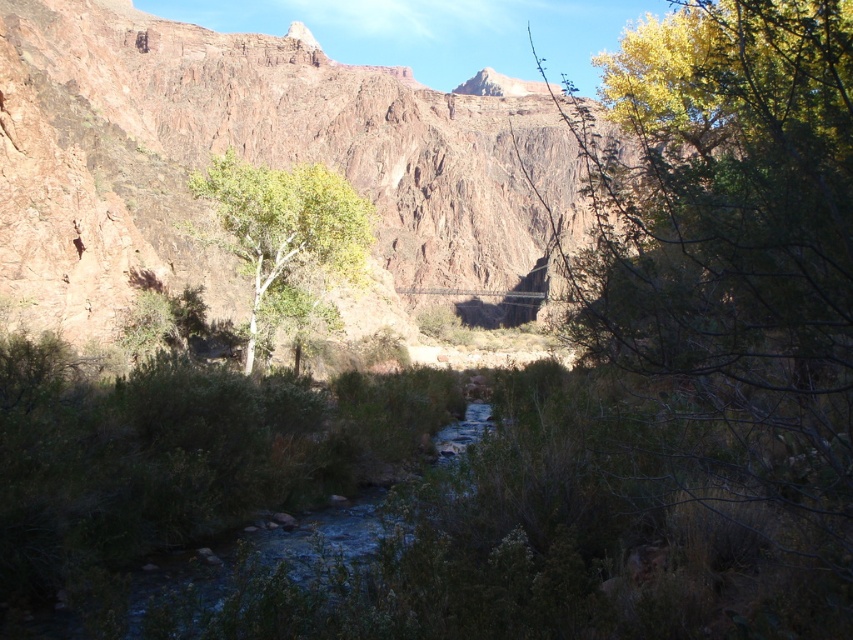
Question: Among these objects, which one is farthest from the camera?

Choices:
 (A) green leafy tree at center
 (B) rustic rock mountain at center

Answer: (A)

Question: Which object appears closest to the camera in this image?

Choices:
 (A) rustic rock mountain at center
 (B) green leafy tree at center

Answer: (A)

Question: Is rustic rock mountain at center to the left of green leafy tree at center from the viewer's perspective?

Choices:
 (A) no
 (B) yes

Answer: (B)

Question: Can you confirm if rustic rock mountain at center is positioned to the left of green leafy tree at center?

Choices:
 (A) no
 (B) yes

Answer: (B)

Question: Can you confirm if rustic rock mountain at center is thinner than green leafy tree at center?

Choices:
 (A) yes
 (B) no

Answer: (B)

Question: Which of the following is the closest to the observer?

Choices:
 (A) tap(18, 104)
 (B) tap(299, 260)

Answer: (A)